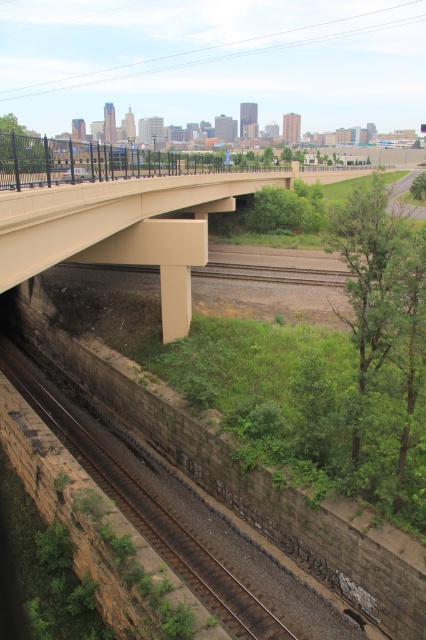
Is green leafy tree at right positioned at the back of green leafy tree at left?

No, it is in front of green leafy tree at left.

Does green leafy tree at right appear over green leafy tree at left?

Actually, green leafy tree at right is below green leafy tree at left.

Measure the distance between point (365,340) and camera.

Point (365,340) and camera are 44.17 feet apart from each other.

In order to click on green leafy tree at right in this screenshot , I will do `click(367, 269)`.

Can you confirm if green leafy tree at center is bigger than green leafy tree at center-right?

Actually, green leafy tree at center might be smaller than green leafy tree at center-right.

Is the position of green leafy tree at center more distant than that of green leafy tree at center-right?

No, green leafy tree at center is in front of green leafy tree at center-right.

Where is `green leafy tree at center`? This screenshot has height=640, width=426. green leafy tree at center is located at coordinates (287, 209).

Where is `green leafy tree at right`? Image resolution: width=426 pixels, height=640 pixels. green leafy tree at right is located at coordinates (367, 269).

Which is more to the left, green leafy tree at right or green leafy tree at center?

From the viewer's perspective, green leafy tree at center appears more on the left side.

Based on the photo, who is more forward, [356,435] or [276,208]?

Point [356,435] is in front.

Identify the location of green leafy tree at right. (367, 269).